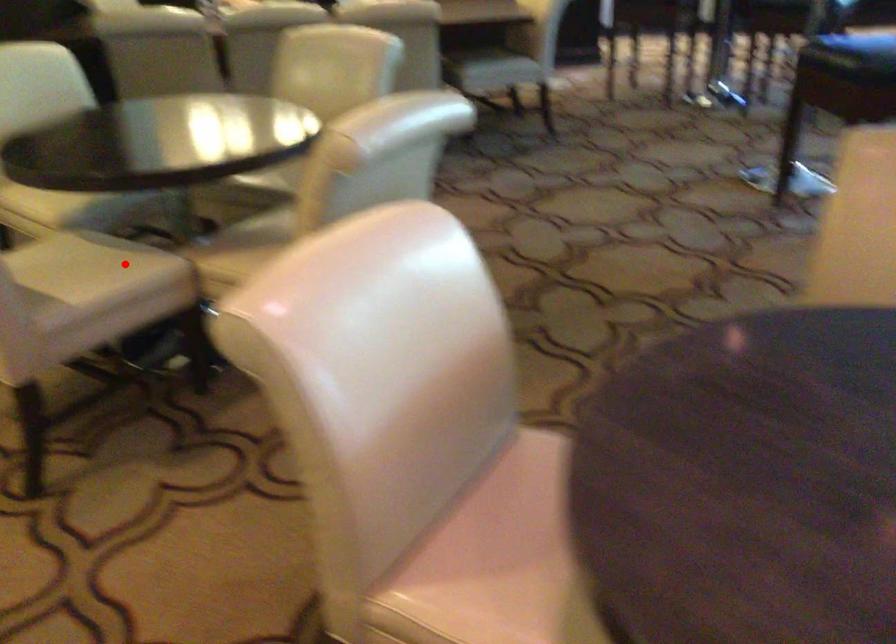
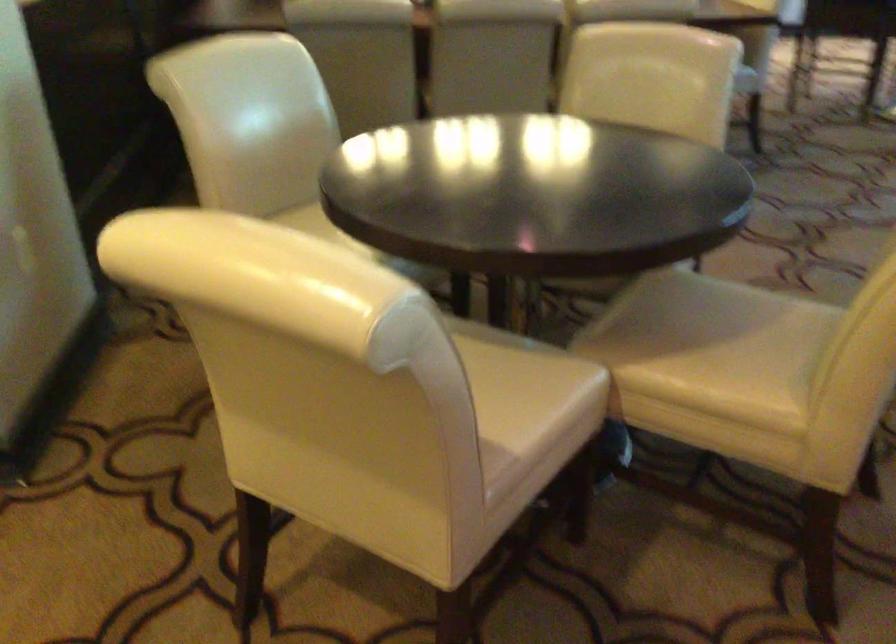
Question: A red point is marked in image1. In image2, is the corresponding 3D point closer to the camera or farther? Reply with the corresponding letter.

Choices:
 (A) The corresponding 3D point is closer.
 (B) The corresponding 3D point is farther.

Answer: (A)